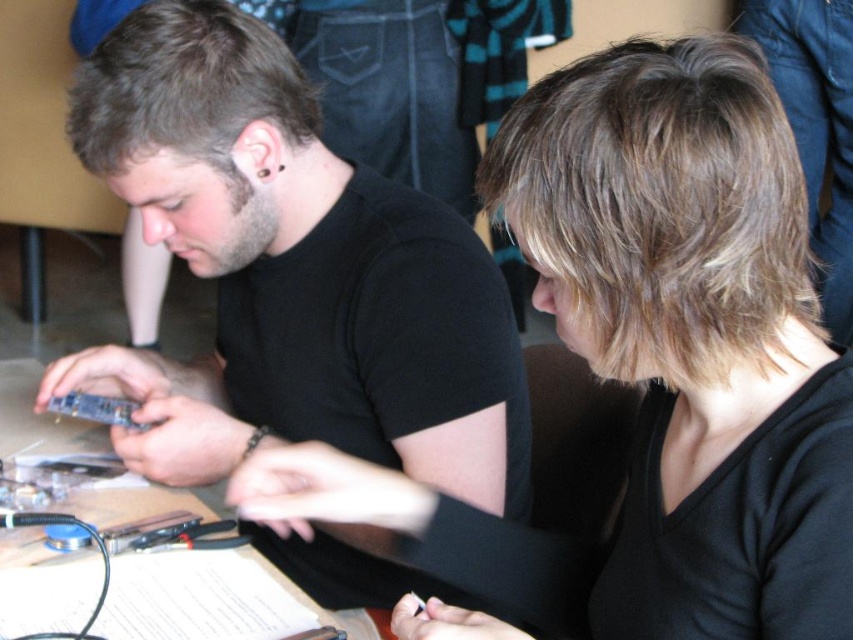
Question: Among these points, which one is nearest to the camera?

Choices:
 (A) (254, 60)
 (B) (200, 516)
 (C) (711, 577)

Answer: (C)

Question: Is black matte hair at upper center positioned in front of blue metallic circuit board at center?

Choices:
 (A) yes
 (B) no

Answer: (A)

Question: Which object is positioned closest to the black matte hair at upper center?

Choices:
 (A) wooden table at center
 (B) matte black shirt at center

Answer: (B)

Question: Is matte black shirt at center wider than blue metallic circuit board at center?

Choices:
 (A) yes
 (B) no

Answer: (A)

Question: Estimate the real-world distances between objects in this image. Which object is closer to the wooden table at center?

Choices:
 (A) matte black shirt at center
 (B) black matte hair at upper center

Answer: (A)

Question: Does wooden table at center appear on the left side of blue metallic circuit board at center?

Choices:
 (A) yes
 (B) no

Answer: (A)